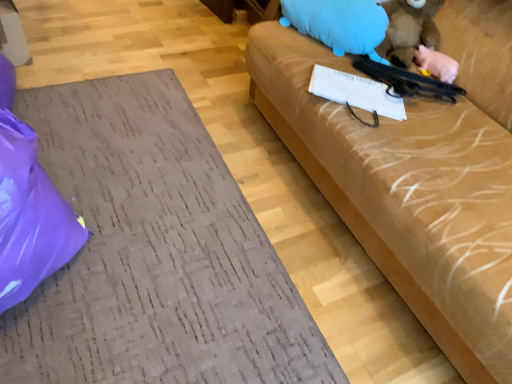
Identify the location of free point behind matte brown couch at right. The height and width of the screenshot is (384, 512). (162, 59).